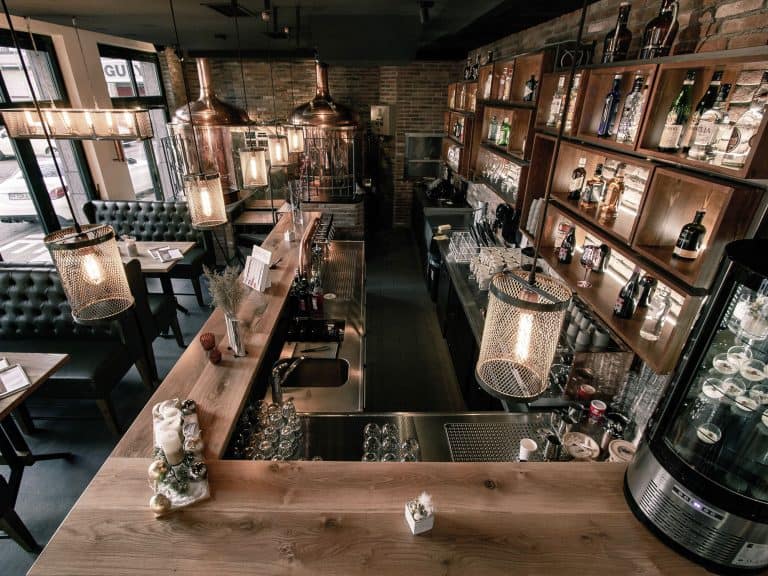
What are the coordinates of `light features` in the screenshot? It's located at (216, 203), (250, 162), (277, 147), (300, 134), (518, 338), (73, 128), (206, 113), (332, 113).